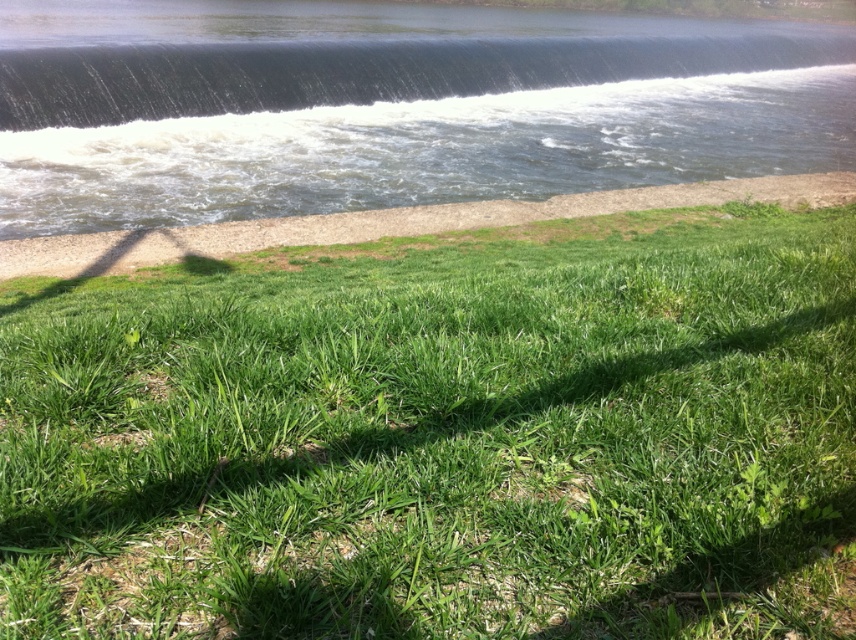
How distant is green grassy at upper center from dark blue water at upper center?

The distance of green grassy at upper center from dark blue water at upper center is 98.44 feet.

Between green grassy at upper center and dark blue water at upper center, which one has less height?

green grassy at upper center

The image size is (856, 640). Describe the element at coordinates (443, 436) in the screenshot. I see `green grassy at upper center` at that location.

The width and height of the screenshot is (856, 640). Identify the location of green grassy at upper center. coord(443,436).